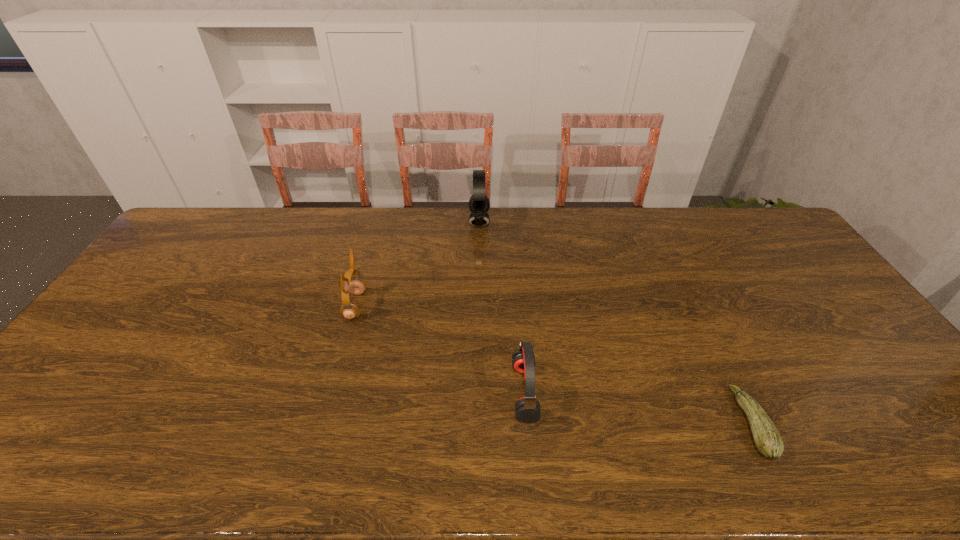
Locate an element on the screen. free space at the left edge of the desktop is located at coordinates (110, 369).

Locate an element on the screen. vacant position at the right edge of the desktop is located at coordinates (886, 375).

The width and height of the screenshot is (960, 540). Identify the location of free space between the rightmost object and the second nearest earphone. (554, 364).

Locate an element on the screen. vacant region between the rightmost object and the nearest earphone is located at coordinates (638, 408).

Find the location of `empty location between the leftmost object and the second earphone from left to right`. empty location between the leftmost object and the second earphone from left to right is located at coordinates (418, 264).

Where is `vacant space that is in between the farthest object and the rightmost object`? The image size is (960, 540). vacant space that is in between the farthest object and the rightmost object is located at coordinates (615, 323).

In order to click on vacant space that is in between the leftmost object and the shortest earphone in this screenshot , I will do `click(440, 349)`.

Identify the location of vacant space that is in between the second nearest earphone and the second object from right to left. The height and width of the screenshot is (540, 960). (440, 349).

Locate an element on the screen. The width and height of the screenshot is (960, 540). vacant point located between the second farthest object and the zucchini is located at coordinates (554, 364).

Find the location of a particular element. free spot between the rightmost earphone and the leftmost object is located at coordinates (440, 349).